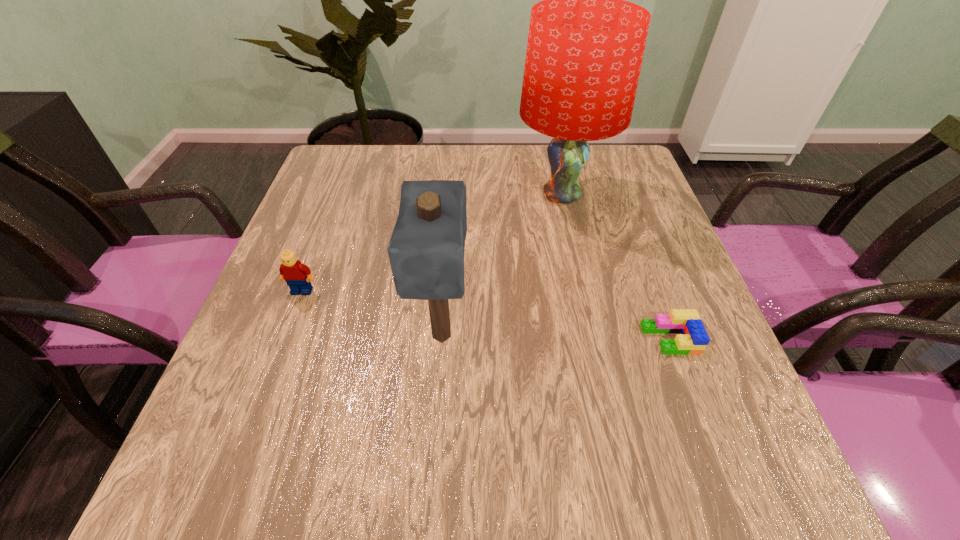
Locate an element on the screen. The image size is (960, 540). lampshade is located at coordinates (585, 48).

Identify the location of the farthest object. Image resolution: width=960 pixels, height=540 pixels. (585, 48).

Identify the location of the third object from right to left. (426, 251).

Locate an element on the screen. the third shortest object is located at coordinates (426, 251).

Identify the location of the farther Lego. The width and height of the screenshot is (960, 540). (292, 271).

This screenshot has height=540, width=960. Identify the location of the third nearest object. (292, 271).

You are a GUI agent. You are given a task and a screenshot of the screen. Output one action in this format:
    pyautogui.click(x=<x>, y=<y>)
    Task: Click on the nearer Lego
    The height and width of the screenshot is (540, 960).
    Given the screenshot: What is the action you would take?
    pyautogui.click(x=693, y=339)

The height and width of the screenshot is (540, 960). Find the location of `the right Lego`. the right Lego is located at coordinates pyautogui.click(x=693, y=339).

Locate an element on the screen. The height and width of the screenshot is (540, 960). vacant area situated 0.150m on the front-facing side of the tallest object is located at coordinates (578, 269).

The width and height of the screenshot is (960, 540). What are the coordinates of `blank space located on the left of the third shortest object` in the screenshot? It's located at (362, 335).